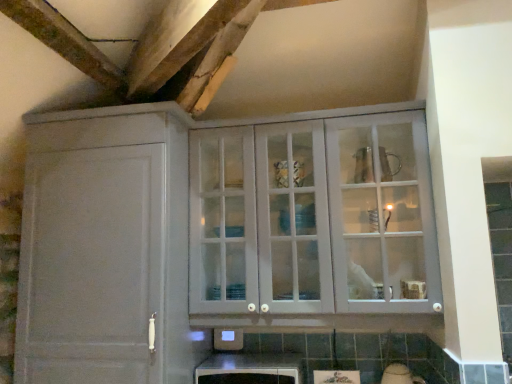
This screenshot has width=512, height=384. Describe the element at coordinates (313, 217) in the screenshot. I see `white glass cabinet at upper center` at that location.

Identify the location of matte gray cabinet at upper center, which appears as the second cabinetry when viewed from the right. This screenshot has height=384, width=512. (105, 247).

Consider the image. Could you tell me if white glass cabinet at upper center is facing white glossy microwave at lower center, arranged as the 2th cabinetry when viewed from the left?

No, white glass cabinet at upper center is not facing towards white glossy microwave at lower center, arranged as the 2th cabinetry when viewed from the left.

In order to click on the 1st cabinetry to the left when counting from the white glass cabinet at upper center in this screenshot , I will do `click(250, 369)`.

Who is taller, white glass cabinet at upper center or white glossy microwave at lower center, marked as the first cabinetry in a right-to-left arrangement?

white glass cabinet at upper center.

Based on the photo, is white glossy microwave at lower center, arranged as the 2th cabinetry when viewed from the left, next to white glass cabinet at upper center and touching it?

No, white glossy microwave at lower center, arranged as the 2th cabinetry when viewed from the left, is not touching white glass cabinet at upper center.

Is white glossy microwave at lower center, arranged as the 2th cabinetry when viewed from the left, behind white glass cabinet at upper center?

Yes, it is behind white glass cabinet at upper center.

Is white glass cabinet at upper center at the back of white glossy microwave at lower center, marked as the first cabinetry in a right-to-left arrangement?

No, white glass cabinet at upper center is not at the back of white glossy microwave at lower center, marked as the first cabinetry in a right-to-left arrangement.

From the picture: From the image's perspective, is white glossy microwave at lower center, marked as the first cabinetry in a right-to-left arrangement, positioned above or below white glass cabinet at upper center?

Clearly, from the image's perspective, white glossy microwave at lower center, marked as the first cabinetry in a right-to-left arrangement, is below white glass cabinet at upper center.

Where is `cabinetry above the white glossy microwave at lower center, marked as the first cabinetry in a right-to-left arrangement (from the image's perspective)`? The image size is (512, 384). cabinetry above the white glossy microwave at lower center, marked as the first cabinetry in a right-to-left arrangement (from the image's perspective) is located at coordinates (105, 247).

From the image's perspective, is matte gray cabinet at upper center, the first cabinetry viewed from the left, located beneath white glossy microwave at lower center, marked as the first cabinetry in a right-to-left arrangement?

No, from the image's perspective, matte gray cabinet at upper center, the first cabinetry viewed from the left, is not below white glossy microwave at lower center, marked as the first cabinetry in a right-to-left arrangement.

Is matte gray cabinet at upper center, which appears as the second cabinetry when viewed from the right, far from white glossy microwave at lower center, marked as the first cabinetry in a right-to-left arrangement?

Actually, matte gray cabinet at upper center, which appears as the second cabinetry when viewed from the right, and white glossy microwave at lower center, marked as the first cabinetry in a right-to-left arrangement, are a little close together.

Between matte gray cabinet at upper center, which appears as the second cabinetry when viewed from the right, and white glossy microwave at lower center, arranged as the 2th cabinetry when viewed from the left, which one is positioned behind?

white glossy microwave at lower center, arranged as the 2th cabinetry when viewed from the left, is more distant.

From a real-world perspective, is matte gray cabinet at upper center, which appears as the second cabinetry when viewed from the right, on white glass cabinet at upper center?

No.

Looking at the image, does matte gray cabinet at upper center, which appears as the second cabinetry when viewed from the right, seem bigger or smaller compared to white glass cabinet at upper center?

Clearly, matte gray cabinet at upper center, which appears as the second cabinetry when viewed from the right, is larger in size than white glass cabinet at upper center.

From the image's perspective, does matte gray cabinet at upper center, which appears as the second cabinetry when viewed from the right, appear higher than white glass cabinet at upper center?

Incorrect, from the image's perspective, matte gray cabinet at upper center, which appears as the second cabinetry when viewed from the right, is lower than white glass cabinet at upper center.

Could you tell me if matte gray cabinet at upper center, the first cabinetry viewed from the left, is facing white glass cabinet at upper center?

No, matte gray cabinet at upper center, the first cabinetry viewed from the left, is not turned towards white glass cabinet at upper center.

From the image's perspective, is white glass cabinet at upper center above matte gray cabinet at upper center, which appears as the second cabinetry when viewed from the right?

Correct, white glass cabinet at upper center appears higher than matte gray cabinet at upper center, which appears as the second cabinetry when viewed from the right, in the image.

Is white glass cabinet at upper center outside of matte gray cabinet at upper center, which appears as the second cabinetry when viewed from the right?

Yes, white glass cabinet at upper center is not within matte gray cabinet at upper center, which appears as the second cabinetry when viewed from the right.

From the picture: What's the angular difference between white glass cabinet at upper center and matte gray cabinet at upper center, the first cabinetry viewed from the left,'s facing directions?

The angle between the facing direction of white glass cabinet at upper center and the facing direction of matte gray cabinet at upper center, the first cabinetry viewed from the left, is 0.498 degrees.

The width and height of the screenshot is (512, 384). I want to click on cupboard above the matte gray cabinet at upper center, which appears as the second cabinetry when viewed from the right (from the image's perspective), so click(313, 217).

Identify the location of cabinetry that appears on the right of matte gray cabinet at upper center, the first cabinetry viewed from the left. (250, 369).

Measure the distance from white glossy microwave at lower center, marked as the first cabinetry in a right-to-left arrangement, to matte gray cabinet at upper center, which appears as the second cabinetry when viewed from the right.

They are 26.42 inches apart.

Is white glossy microwave at lower center, marked as the first cabinetry in a right-to-left arrangement, next to matte gray cabinet at upper center, which appears as the second cabinetry when viewed from the right, and touching it?

white glossy microwave at lower center, marked as the first cabinetry in a right-to-left arrangement, and matte gray cabinet at upper center, which appears as the second cabinetry when viewed from the right, are clearly separated.

Find the location of a particular element. This screenshot has width=512, height=384. cupboard lying in front of the white glossy microwave at lower center, arranged as the 2th cabinetry when viewed from the left is located at coordinates (313, 217).

Locate an element on the screen. cupboard that appears above the white glossy microwave at lower center, marked as the first cabinetry in a right-to-left arrangement (from a real-world perspective) is located at coordinates (313, 217).

Looking at this image, which object lies nearer to the anchor point white glossy microwave at lower center, marked as the first cabinetry in a right-to-left arrangement, white glass cabinet at upper center or matte gray cabinet at upper center, which appears as the second cabinetry when viewed from the right?

matte gray cabinet at upper center, which appears as the second cabinetry when viewed from the right, is closer to white glossy microwave at lower center, marked as the first cabinetry in a right-to-left arrangement.

Looking at the image, which one is located further to white glass cabinet at upper center, matte gray cabinet at upper center, which appears as the second cabinetry when viewed from the right, or white glossy microwave at lower center, marked as the first cabinetry in a right-to-left arrangement?

Among the two, white glossy microwave at lower center, marked as the first cabinetry in a right-to-left arrangement, is located further to white glass cabinet at upper center.

Estimate the real-world distances between objects in this image. Which object is further from matte gray cabinet at upper center, the first cabinetry viewed from the left, white glossy microwave at lower center, marked as the first cabinetry in a right-to-left arrangement, or white glass cabinet at upper center?

Based on the image, white glossy microwave at lower center, marked as the first cabinetry in a right-to-left arrangement, appears to be further to matte gray cabinet at upper center, the first cabinetry viewed from the left.

Estimate the real-world distances between objects in this image. Which object is closer to white glossy microwave at lower center, arranged as the 2th cabinetry when viewed from the left, matte gray cabinet at upper center, which appears as the second cabinetry when viewed from the right, or white glass cabinet at upper center?

Among the two, matte gray cabinet at upper center, which appears as the second cabinetry when viewed from the right, is located nearer to white glossy microwave at lower center, arranged as the 2th cabinetry when viewed from the left.

In the scene shown: Based on their spatial positions, is white glossy microwave at lower center, marked as the first cabinetry in a right-to-left arrangement, or matte gray cabinet at upper center, the first cabinetry viewed from the left, further from white glass cabinet at upper center?

white glossy microwave at lower center, marked as the first cabinetry in a right-to-left arrangement, is further to white glass cabinet at upper center.

Estimate the real-world distances between objects in this image. Which object is further from matte gray cabinet at upper center, the first cabinetry viewed from the left, white glass cabinet at upper center or white glossy microwave at lower center, marked as the first cabinetry in a right-to-left arrangement?

Among the two, white glossy microwave at lower center, marked as the first cabinetry in a right-to-left arrangement, is located further to matte gray cabinet at upper center, the first cabinetry viewed from the left.

Identify the location of cabinetry situated between matte gray cabinet at upper center, the first cabinetry viewed from the left, and white glass cabinet at upper center from left to right. Image resolution: width=512 pixels, height=384 pixels. (250, 369).